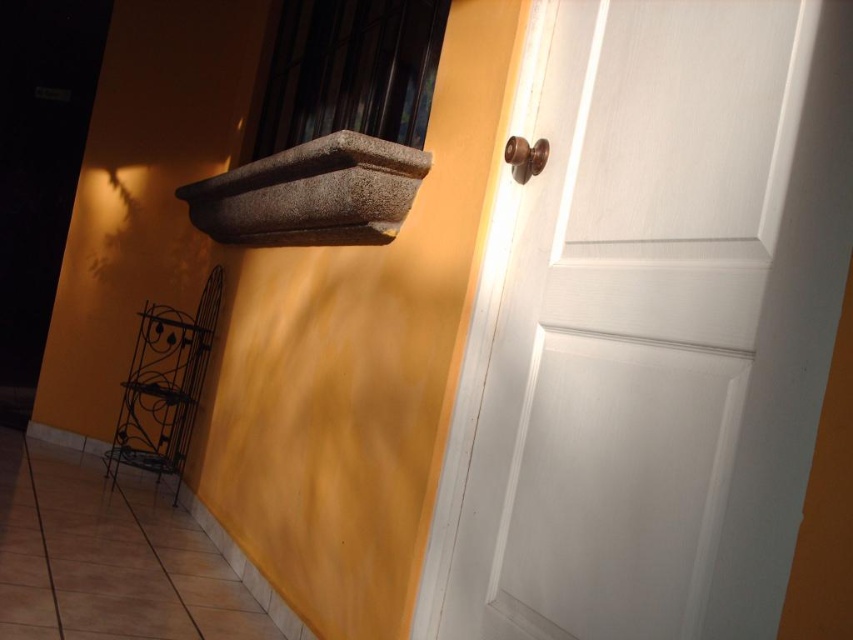
You are standing in a room with a white wood door at right. There is a small decorative wrought iron shelf on the left wall and a rectangular stone planter box mounted on the wall in the center left area. A point at coordinates (x=660, y=324) is present. Is this point located on the white wood door at right?

Yes, the point at coordinates (x=660, y=324) is on the white wood door at right according to the description.

In the scene shown: You are moving a 2.5 meter long wooden ladder into this room. The ladder is too long to carry through the doorway. You need to disassemble it into two equal parts. After cutting it in half, each segment will be 1.25 meters long. Now, you want to place one of these halves horizontally on the white wood door at right and the other half on the granite ledge at upper left. Which surface can accommodate the 1.25 meter segment without overhanging?

The granite ledge at upper left can accommodate the 1.25 meter segment since its length is longer than the white wood door at right, which has a shorter width according to the description.

You are trying to reach the brown polished door handle at upper right to open the door, but there is a granite ledge at upper left in the way. Can you move around the ledge to access the handle?

The granite ledge at upper left is positioned over the brown polished door handle at upper right, so you can move around the ledge to the right side to access the handle.